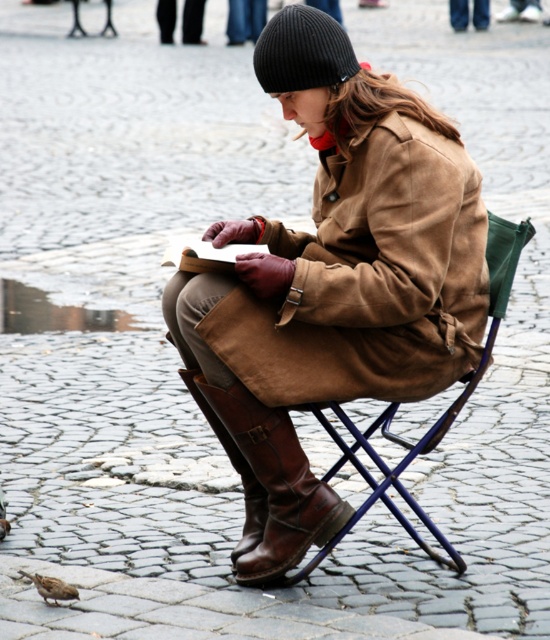
You are a photographer trying to capture the scene of a person reading outdoors. You notice the blue metal folding chair at center and the black knit beanie at upper center. Which object is located to the right of the other?

The blue metal folding chair at center is positioned on the right side of black knit beanie at upper center.

Looking at this image, you are a photographer trying to capture a photo of the brown suede coat at center and the brown feathered pigeon at lower left. Which object should you focus on first if you want to ensure both are in sharp focus, given their height difference?

The brown suede coat at center is taller than the brown feathered pigeon at lower left. To ensure both are in sharp focus, you should focus on the brown suede coat at center first since it is taller and likely farther away, allowing the pigeon to fall within the depth of field.